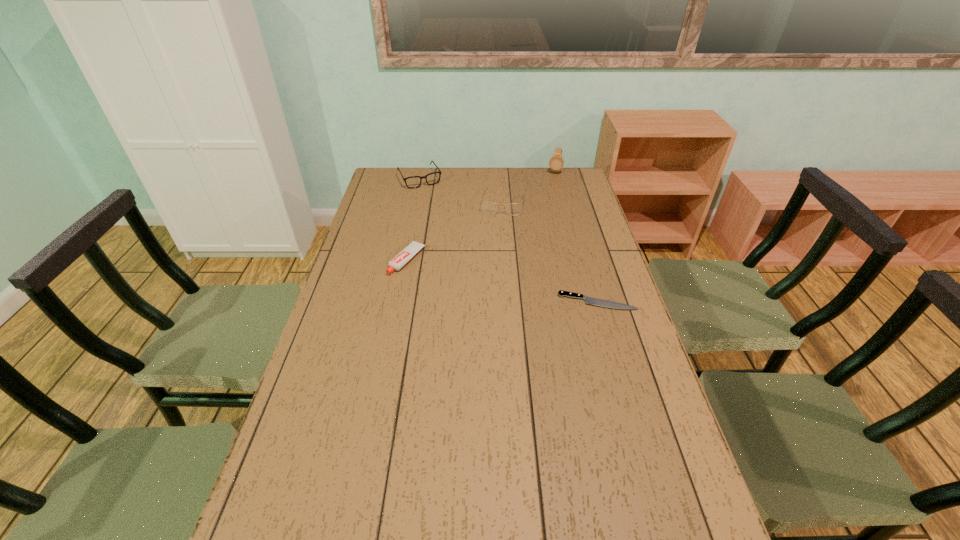
At what (x,y) coordinates should I click in order to perform the action: click on free region at the far right corner. Please return your answer as a coordinate pair (x, y). Looking at the image, I should click on (552, 180).

This screenshot has height=540, width=960. In the image, there is a desktop. In order to click on vacant space at the near right corner in this screenshot , I will do `click(633, 501)`.

At what (x,y) coordinates should I click in order to perform the action: click on free space between the third object from left to right and the nearest object. Please return your answer as a coordinate pair (x, y). The width and height of the screenshot is (960, 540). Looking at the image, I should click on (550, 253).

Find the location of a particular element. This screenshot has height=540, width=960. free spot between the nearest object and the tallest object is located at coordinates (576, 237).

The image size is (960, 540). In order to click on free point between the watch and the shortest object in this screenshot , I will do `click(576, 237)`.

Where is `free point between the watch and the fourth farthest object`? This screenshot has height=540, width=960. free point between the watch and the fourth farthest object is located at coordinates (481, 216).

The image size is (960, 540). Identify the location of vacant area between the steak knife and the farther spectacles. (509, 240).

Image resolution: width=960 pixels, height=540 pixels. I want to click on free space between the farther spectacles and the steak knife, so click(x=509, y=240).

This screenshot has width=960, height=540. In order to click on free space between the tallest object and the toothpaste in this screenshot , I will do `click(481, 216)`.

Identify the location of vacant area that lies between the tallest object and the farther spectacles. (487, 175).